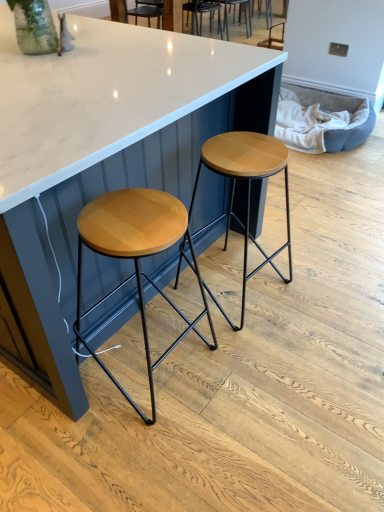
This screenshot has width=384, height=512. What are the coordinates of `vacant space in woodenmaterial/texturestool at left, arranged as the first stool when viewed from the left (from a real-world perspective)` in the screenshot? It's located at (157, 367).